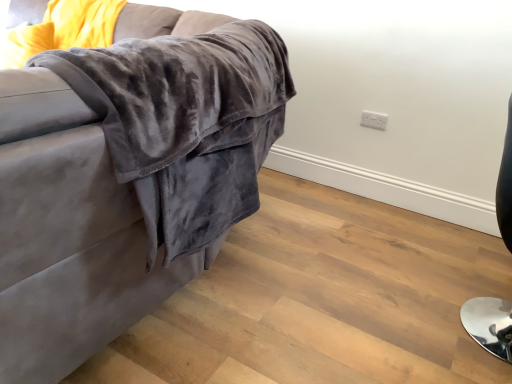
Locate an element on the screen. free space underneath shiny black chair at right (from a real-world perspective) is located at coordinates (470, 308).